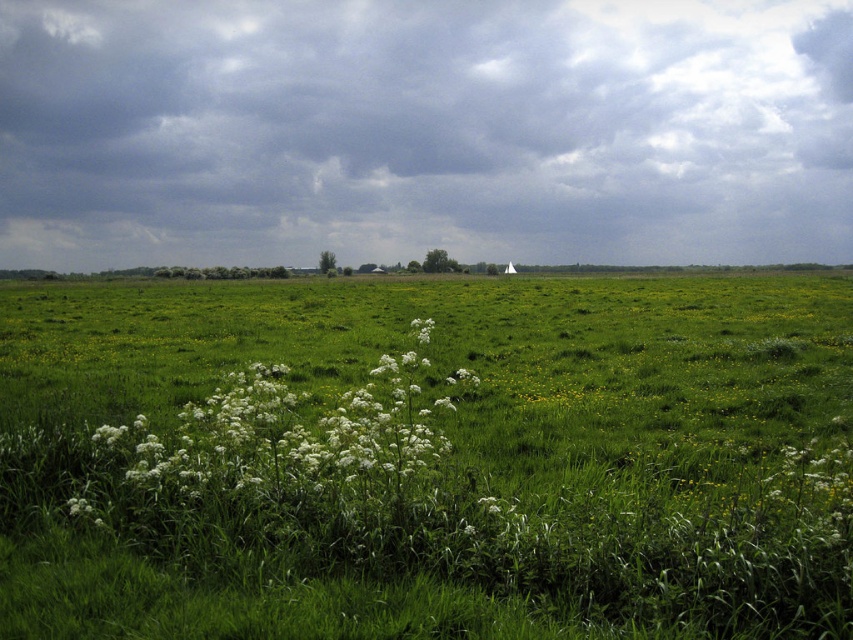
Question: Is cloudy sky at center behind white fluffy plant at center?

Choices:
 (A) yes
 (B) no

Answer: (A)

Question: Which point is closer to the camera?

Choices:
 (A) (344, 236)
 (B) (412, 396)

Answer: (B)

Question: Can you confirm if cloudy sky at center is smaller than white fluffy plant at center?

Choices:
 (A) yes
 (B) no

Answer: (B)

Question: Is cloudy sky at center above white fluffy plant at center?

Choices:
 (A) no
 (B) yes

Answer: (B)